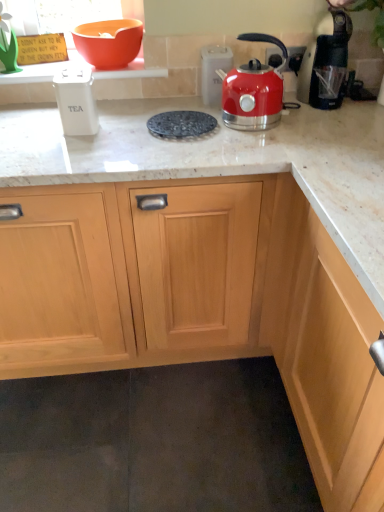
The width and height of the screenshot is (384, 512). I want to click on free spot in front of shiny metallic kettle at upper right, the third kitchen appliance viewed from the left, so click(257, 150).